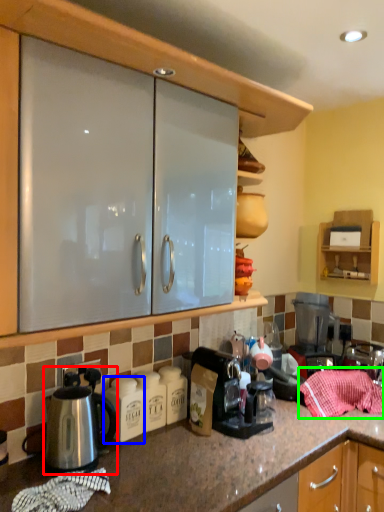
Question: Which object is positioned closest to kettle (highlighted by a red box)? Select from appliance (highlighted by a blue box) and blanket (highlighted by a green box).

Choices:
 (A) appliance
 (B) blanket

Answer: (A)